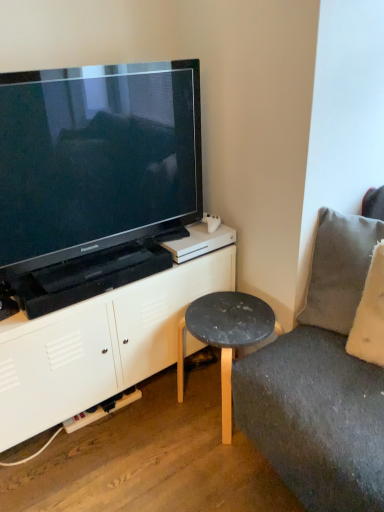
Locate an element on the screen. This screenshot has width=384, height=512. black glossy television at upper left is located at coordinates [x=95, y=179].

Find the location of a particular element. This screenshot has width=384, height=512. white matte cabinet at lower left is located at coordinates coord(98,345).

Describe the element at coordinates (224, 337) in the screenshot. The width and height of the screenshot is (384, 512). I see `matte black stool at lower center` at that location.

Measure the distance between point (327, 226) and camera.

The depth of point (327, 226) is 1.55 meters.

Identify the location of black glossy television at upper left. This screenshot has height=512, width=384. (95, 179).

Find the location of a particular element. cabinetry on the left of black glossy television at upper left is located at coordinates (98, 345).

Considering the positions of points (85, 229) and (89, 322), is point (85, 229) closer to camera compared to point (89, 322)?

Yes, point (85, 229) is in front of point (89, 322).

Consider the image. From the image's perspective, is black glossy television at upper left on top of white matte cabinet at lower left?

Yes, from the image's perspective, black glossy television at upper left is above white matte cabinet at lower left.

Does black glossy television at upper left have a greater height compared to white matte cabinet at lower left?

Indeed, black glossy television at upper left has a greater height compared to white matte cabinet at lower left.

Is black glossy television at upper left to the left of gray fabric pillow at right from the viewer's perspective?

Yes, black glossy television at upper left is to the left of gray fabric pillow at right.

Is black glossy television at upper left taller or shorter than gray fabric pillow at right?

Considering their sizes, black glossy television at upper left has more height than gray fabric pillow at right.

In the image, is black glossy television at upper left positioned in front of or behind gray fabric pillow at right?

Visually, black glossy television at upper left is located in front of gray fabric pillow at right.

From the image's perspective, is black glossy television at upper left beneath gray fabric pillow at right?

Actually, black glossy television at upper left appears above gray fabric pillow at right in the image.

Is matte black stool at lower center placed right next to gray fabric pillow at right?

No, matte black stool at lower center is not touching gray fabric pillow at right.

Considering their positions, is matte black stool at lower center located in front of or behind gray fabric pillow at right?

Visually, matte black stool at lower center is located behind gray fabric pillow at right.

Is matte black stool at lower center facing away from gray fabric pillow at right?

No.

From a real-world perspective, is matte black stool at lower center above or below gray fabric pillow at right?

From a real-world perspective, matte black stool at lower center is physically below gray fabric pillow at right.

Considering the positions of objects black glossy television at upper left and matte black stool at lower center in the image provided, who is more to the right, black glossy television at upper left or matte black stool at lower center?

matte black stool at lower center.

Based on the photo, considering the relative sizes of black glossy television at upper left and matte black stool at lower center in the image provided, is black glossy television at upper left wider than matte black stool at lower center?

Incorrect, the width of black glossy television at upper left does not surpass that of matte black stool at lower center.

I want to click on table beneath the black glossy television at upper left (from a real-world perspective), so click(224, 337).

Is black glossy television at upper left far away from matte black stool at lower center?

No.

Where is `cabinetry in front of the matte black stool at lower center`? cabinetry in front of the matte black stool at lower center is located at coordinates (98, 345).

From a real-world perspective, between white matte cabinet at lower left and matte black stool at lower center, who is vertically higher?

white matte cabinet at lower left.

Which of these two, white matte cabinet at lower left or matte black stool at lower center, is thinner?

matte black stool at lower center.

Considering the positions of objects white matte cabinet at lower left and matte black stool at lower center in the image provided, who is more to the left, white matte cabinet at lower left or matte black stool at lower center?

white matte cabinet at lower left is more to the left.

Is white matte cabinet at lower left at the left side of black glossy television at upper left?

Correct, you'll find white matte cabinet at lower left to the left of black glossy television at upper left.

Is white matte cabinet at lower left situated inside black glossy television at upper left or outside?

The correct answer is: outside.

In the image, is white matte cabinet at lower left positioned in front of or behind black glossy television at upper left?

white matte cabinet at lower left is behind black glossy television at upper left.

In order to click on table that is below the gray fabric pillow at right (from the image's perspective) in this screenshot , I will do `click(224, 337)`.

From a real-world perspective, between gray fabric pillow at right and matte black stool at lower center, who is vertically higher?

In real-world perspective, gray fabric pillow at right is above.

Looking at this image, is gray fabric pillow at right facing away from matte black stool at lower center?

No, matte black stool at lower center is not at the back of gray fabric pillow at right.

Can you confirm if gray fabric pillow at right is bigger than matte black stool at lower center?

No.

Image resolution: width=384 pixels, height=512 pixels. Find the location of `cabinetry below the black glossy television at upper left (from the image's perspective)`. cabinetry below the black glossy television at upper left (from the image's perspective) is located at coordinates [x=98, y=345].

Identify the location of television above the gray fabric pillow at right (from a real-world perspective). The image size is (384, 512). (95, 179).

Which object lies nearer to the anchor point gray fabric pillow at right, black glossy television at upper left or matte black stool at lower center?

matte black stool at lower center is positioned closer to the anchor gray fabric pillow at right.

Considering their positions, is black glossy television at upper left positioned closer to white matte cabinet at lower left than matte black stool at lower center?

matte black stool at lower center.

Considering their positions, is gray fabric pillow at right positioned further to black glossy television at upper left than white matte cabinet at lower left?

gray fabric pillow at right.

Looking at the image, which one is located closer to matte black stool at lower center, gray fabric pillow at right or black glossy television at upper left?

Based on the image, gray fabric pillow at right appears to be nearer to matte black stool at lower center.

From the image, which object appears to be farther from black glossy television at upper left, white matte cabinet at lower left or gray fabric pillow at right?

gray fabric pillow at right is positioned further to the anchor black glossy television at upper left.

From the picture: Based on their spatial positions, is white matte cabinet at lower left or black glossy television at upper left further from gray fabric pillow at right?

Among the two, black glossy television at upper left is located further to gray fabric pillow at right.

Which object lies further to the anchor point black glossy television at upper left, white matte cabinet at lower left or matte black stool at lower center?

matte black stool at lower center lies further to black glossy television at upper left than the other object.

Based on their spatial positions, is black glossy television at upper left or gray fabric pillow at right closer to white matte cabinet at lower left?

black glossy television at upper left is closer to white matte cabinet at lower left.

Where is `table between white matte cabinet at lower left and gray fabric pillow at right`? table between white matte cabinet at lower left and gray fabric pillow at right is located at coordinates (224, 337).

Where is `cabinetry between black glossy television at upper left and matte black stool at lower center in the vertical direction`? The width and height of the screenshot is (384, 512). cabinetry between black glossy television at upper left and matte black stool at lower center in the vertical direction is located at coordinates (98, 345).

Find the location of a particular element. The width and height of the screenshot is (384, 512). table between black glossy television at upper left and gray fabric pillow at right in the horizontal direction is located at coordinates (224, 337).

Locate an element on the screen. television between white matte cabinet at lower left and gray fabric pillow at right is located at coordinates (95, 179).